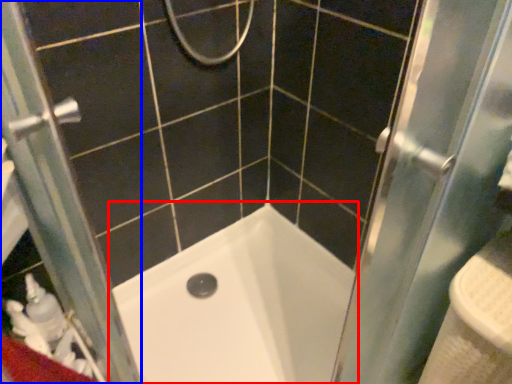
Question: Which of the following is the closest to the observer, bathtub (highlighted by a red box) or screen door (highlighted by a blue box)?

Choices:
 (A) bathtub
 (B) screen door

Answer: (B)